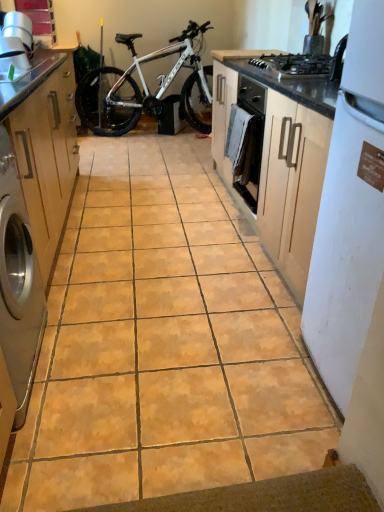
What is the approximate height of matte wood cabinet at left?

35.95 inches.

Describe the element at coordinates (46, 151) in the screenshot. I see `matte wood cabinet at left` at that location.

Describe the element at coordinates (350, 212) in the screenshot. The height and width of the screenshot is (512, 384). I see `white matte refrigerator at right` at that location.

What are the coordinates of `matte wood cabinet at left` in the screenshot? It's located at (46, 151).

Do you think white matte refrigerator at right is within satin silver washing machine at left, or outside of it?

white matte refrigerator at right is located beyond the bounds of satin silver washing machine at left.

Find the location of `home appliance below the white matte refrigerator at right (from a real-world perspective)`. home appliance below the white matte refrigerator at right (from a real-world perspective) is located at coordinates (18, 285).

Does white matte refrigerator at right have a greater width compared to satin silver washing machine at left?

Yes.

From the image's perspective, which is above, matte wood cabinet at left or white matte bicycle at center?

white matte bicycle at center, from the image's perspective.

Consider the image. Considering the sizes of objects matte wood cabinet at left and white matte bicycle at center in the image provided, who is smaller, matte wood cabinet at left or white matte bicycle at center?

With smaller size is white matte bicycle at center.

Is matte wood cabinet at left wider than white matte bicycle at center?

Indeed, matte wood cabinet at left has a greater width compared to white matte bicycle at center.

From the image's perspective, would you say white matte bicycle at center is positioned over white matte refrigerator at right?

Correct, white matte bicycle at center appears higher than white matte refrigerator at right in the image.

From a real-world perspective, is white matte bicycle at center below white matte refrigerator at right?

Yes, from a real-world perspective, white matte bicycle at center is under white matte refrigerator at right.

Is white matte bicycle at center not close to white matte refrigerator at right?

Yes.

Consider the image. Does white matte bicycle at center have a smaller size compared to white matte refrigerator at right?

No.

Is satin silver washing machine at left taller or shorter than matte wood cabinet at left?

Clearly, satin silver washing machine at left is shorter compared to matte wood cabinet at left.

From the image's perspective, would you say satin silver washing machine at left is positioned over matte wood cabinet at left?

Actually, satin silver washing machine at left appears below matte wood cabinet at left in the image.

Looking at this image, which of these two, satin silver washing machine at left or matte wood cabinet at left, is thinner?

With smaller width is satin silver washing machine at left.

From a real-world perspective, is satin silver washing machine at left physically below matte wood cabinet at left?

Yes, from a real-world perspective, satin silver washing machine at left is under matte wood cabinet at left.

Which of these two, satin silver washing machine at left or black matte gas stove at upper right, stands shorter?

With less height is black matte gas stove at upper right.

Is satin silver washing machine at left far from black matte gas stove at upper right?

Indeed, satin silver washing machine at left is not near black matte gas stove at upper right.

Which is in front, point (0, 234) or point (311, 66)?

The point (0, 234) is closer to the camera.

Is satin silver washing machine at left aimed at black matte gas stove at upper right?

No, satin silver washing machine at left is not facing towards black matte gas stove at upper right.

Is the position of white matte bicycle at center more distant than that of matte wood cabinet at left?

Yes, it is behind matte wood cabinet at left.

Is white matte bicycle at center inside the boundaries of matte wood cabinet at left, or outside?

white matte bicycle at center is not inside matte wood cabinet at left, it's outside.

From a real-world perspective, is white matte bicycle at center on matte wood cabinet at left?

Yes, from a real-world perspective, white matte bicycle at center is on top of matte wood cabinet at left.

This screenshot has height=512, width=384. Find the location of `cabinetry beneath the white matte bicycle at center (from a real-world perspective)`. cabinetry beneath the white matte bicycle at center (from a real-world perspective) is located at coordinates (46, 151).

Which object is positioned more to the left, matte wood cabinet at left or satin silver washing machine at left?

matte wood cabinet at left.

Looking at this image, between matte wood cabinet at left and satin silver washing machine at left, which one has smaller size?

satin silver washing machine at left is smaller.

Which of these two, matte wood cabinet at left or satin silver washing machine at left, stands shorter?

Standing shorter between the two is satin silver washing machine at left.

Is matte wood cabinet at left in front of or behind satin silver washing machine at left in the image?

matte wood cabinet at left is positioned farther from the viewer than satin silver washing machine at left.

This screenshot has height=512, width=384. I want to click on home appliance behind the white matte refrigerator at right, so click(x=18, y=285).

The image size is (384, 512). I want to click on cabinetry that is under the white matte bicycle at center (from a real-world perspective), so click(x=46, y=151).

From the image, which object appears to be nearer to satin silver washing machine at left, white matte bicycle at center or black matte gas stove at upper right?

The object closer to satin silver washing machine at left is black matte gas stove at upper right.

Which object lies further to the anchor point white matte refrigerator at right, white matte bicycle at center or matte wood cabinet at left?

white matte bicycle at center is further to white matte refrigerator at right.

Looking at the image, which one is located closer to white matte refrigerator at right, white matte bicycle at center or satin silver washing machine at left?

Based on the image, satin silver washing machine at left appears to be nearer to white matte refrigerator at right.

In the scene shown: Looking at the image, which one is located further to white matte refrigerator at right, black matte gas stove at upper right or satin silver washing machine at left?

black matte gas stove at upper right lies further to white matte refrigerator at right than the other object.

Looking at the image, which one is located further to black matte gas stove at upper right, satin silver washing machine at left or white matte bicycle at center?

white matte bicycle at center is further to black matte gas stove at upper right.

Estimate the real-world distances between objects in this image. Which object is further from white matte bicycle at center, black matte gas stove at upper right or matte wood cabinet at left?

Among the two, black matte gas stove at upper right is located further to white matte bicycle at center.

Based on their spatial positions, is white matte refrigerator at right or satin silver washing machine at left further from matte wood cabinet at left?

Among the two, white matte refrigerator at right is located further to matte wood cabinet at left.

When comparing their distances from satin silver washing machine at left, does white matte bicycle at center or white matte refrigerator at right seem further?

Based on the image, white matte bicycle at center appears to be further to satin silver washing machine at left.

Locate an element on the screen. This screenshot has width=384, height=512. home appliance located between white matte refrigerator at right and white matte bicycle at center in the depth direction is located at coordinates (18, 285).

Identify the location of gas stove between satin silver washing machine at left and white matte refrigerator at right. (299, 64).

The width and height of the screenshot is (384, 512). What are the coordinates of `home appliance between matte wood cabinet at left and black matte gas stove at upper right from left to right` in the screenshot? It's located at (18, 285).

What are the coordinates of `cabinetry between satin silver washing machine at left and white matte bicycle at center from front to back` in the screenshot? It's located at (46, 151).